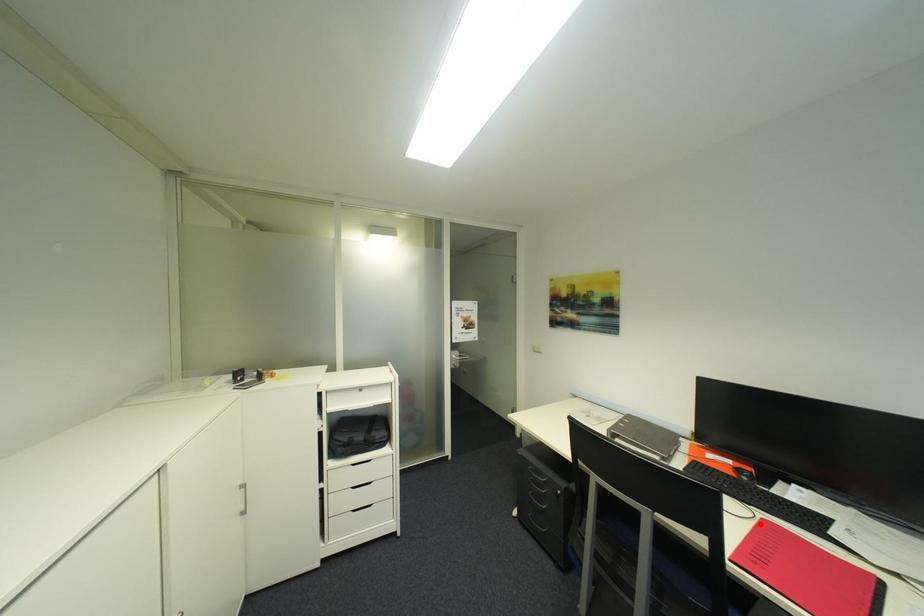
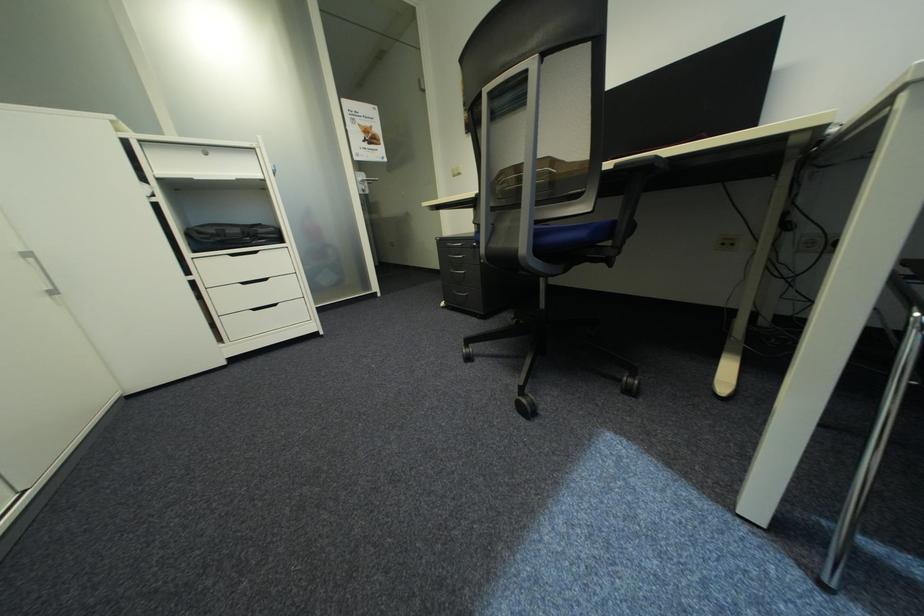
Question: I am providing you with two images of the same scene from different viewpoints. A red point is marked on the first image. At the location where the point appears in image 1, is it still visible in image 2?

Choices:
 (A) Yes
 (B) No

Answer: (B)